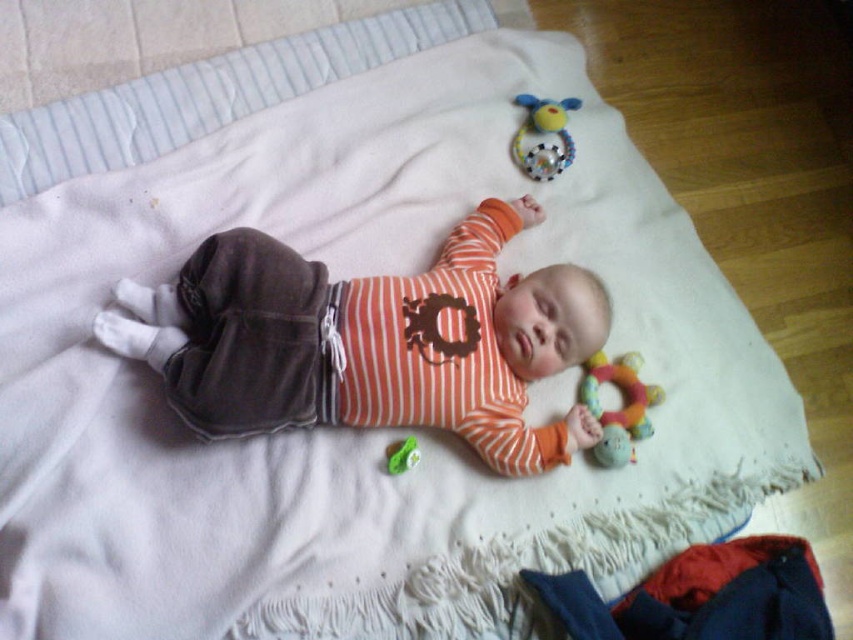
Does multicolored rubber ring at lower right come in front of plush rubber rattle at upper right?

Yes, it is.

Does multicolored rubber ring at lower right have a lesser width compared to plush rubber rattle at upper right?

In fact, multicolored rubber ring at lower right might be wider than plush rubber rattle at upper right.

Identify the location of multicolored rubber ring at lower right. This screenshot has height=640, width=853. (618, 408).

Where is `multicolored rubber ring at lower right`? Image resolution: width=853 pixels, height=640 pixels. multicolored rubber ring at lower right is located at coordinates (618, 408).

Between matte orange striped shirt at center and green rubber toy at center, which one has more height?

matte orange striped shirt at center is taller.

Measure the distance between matte orange striped shirt at center and green rubber toy at center.

They are 9.17 inches apart.

The image size is (853, 640). What do you see at coordinates (370, 340) in the screenshot?
I see `matte orange striped shirt at center` at bounding box center [370, 340].

Locate an element on the screen. The height and width of the screenshot is (640, 853). matte orange striped shirt at center is located at coordinates (370, 340).

Is multicolored rubber ring at lower right wider than green rubber toy at center?

Correct, the width of multicolored rubber ring at lower right exceeds that of green rubber toy at center.

Is point (618, 410) positioned behind point (415, 464)?

Yes, it is behind point (415, 464).

Is point (604, 364) positioned in front of point (415, 452)?

That is False.

Locate an element on the screen. The image size is (853, 640). multicolored rubber ring at lower right is located at coordinates (618, 408).